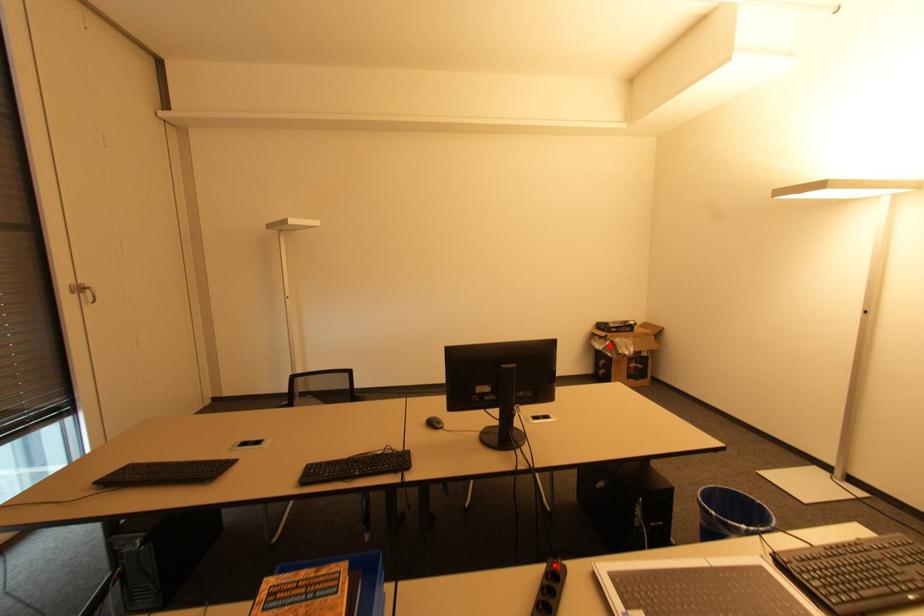
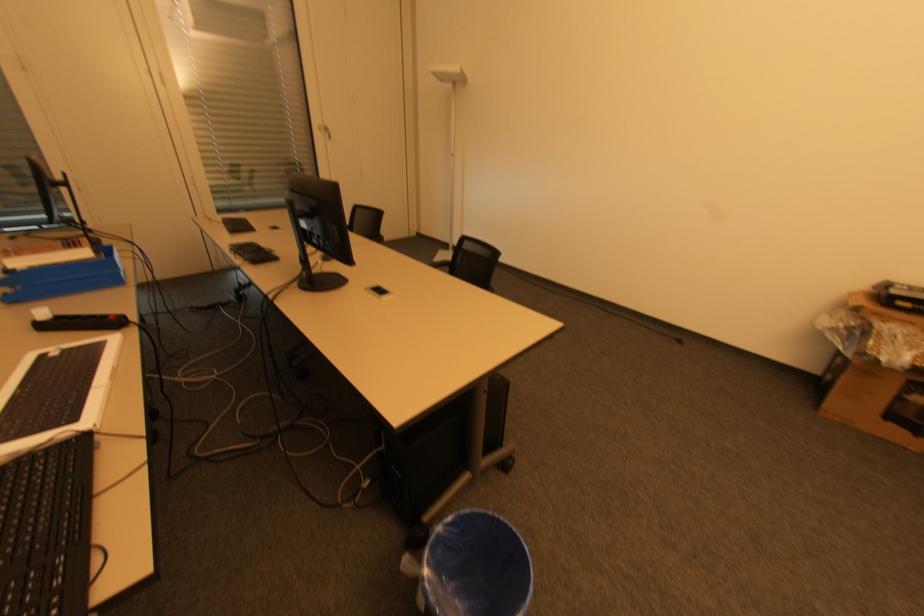
Question: I am providing you with two images of the same scene from different viewpoints. A red point is shown in image1. For the corresponding object point in image2, is it positioned nearer or farther from the camera?

Choices:
 (A) Nearer
 (B) Farther

Answer: (B)